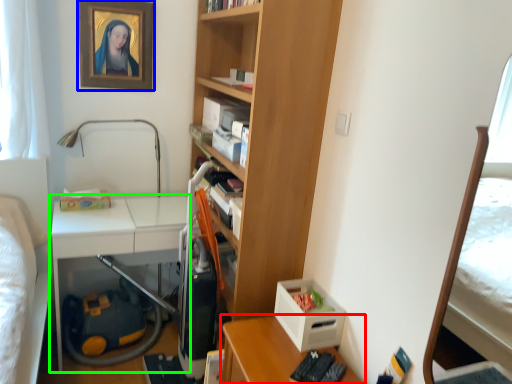
Question: Which object is the closest to the desk (highlighted by a red box)? Choose among these: picture frame (highlighted by a blue box) or table (highlighted by a green box).

Choices:
 (A) picture frame
 (B) table

Answer: (B)